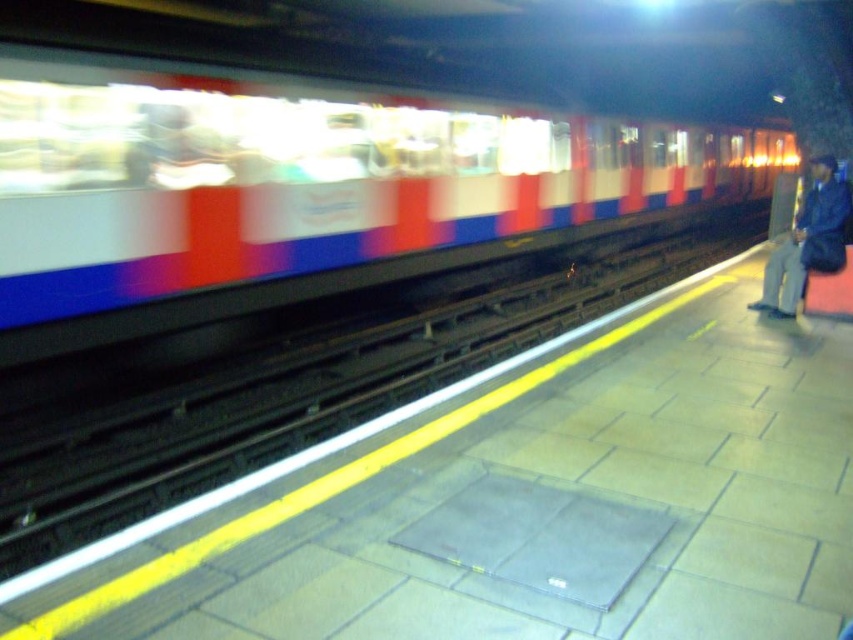
Is point (21, 116) more distant than point (834, 268)?

No, (21, 116) is in front of (834, 268).

Who is taller, white glossy train at center or blue denim jacket at right?

With more height is white glossy train at center.

Describe the element at coordinates (299, 188) in the screenshot. The height and width of the screenshot is (640, 853). I see `white glossy train at center` at that location.

In order to click on white glossy train at center in this screenshot , I will do `click(299, 188)`.